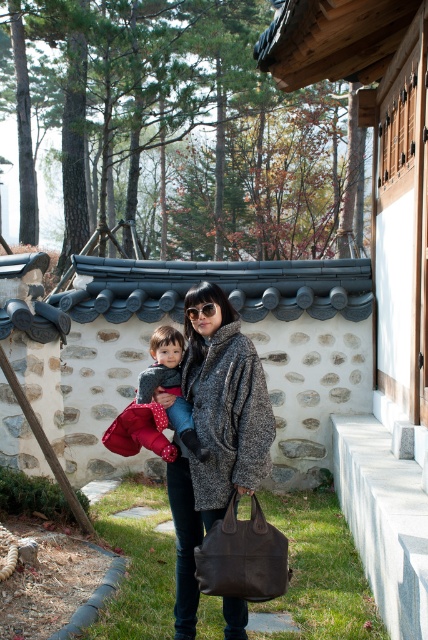
Who is positioned more to the left, brown leather bag at lower center or polka dot fabric baby at center?

polka dot fabric baby at center is more to the left.

Can you confirm if brown leather bag at lower center is positioned above polka dot fabric baby at center?

No, brown leather bag at lower center is not above polka dot fabric baby at center.

At what (x,y) coordinates should I click in order to perform the action: click on brown leather bag at lower center. Please return your answer as a coordinate pair (x, y). The height and width of the screenshot is (640, 428). Looking at the image, I should click on (243, 556).

At what (x,y) coordinates should I click in order to perform the action: click on brown leather bag at lower center. Please return your answer as a coordinate pair (x, y). Image resolution: width=428 pixels, height=640 pixels. Looking at the image, I should click on (243, 556).

Can you confirm if textured gray coat at center is thinner than polka dot fabric baby at center?

No, textured gray coat at center is not thinner than polka dot fabric baby at center.

This screenshot has width=428, height=640. In order to click on textured gray coat at center in this screenshot , I will do `click(214, 433)`.

Which is in front, point (205, 445) or point (162, 333)?

Point (205, 445)

What are the coordinates of `textured gray coat at center` in the screenshot? It's located at (214, 433).

From the picture: Does textured gray coat at center have a lesser height compared to brown leather bag at lower center?

Incorrect, textured gray coat at center's height does not fall short of brown leather bag at lower center's.

Is textured gray coat at center to the right of brown leather bag at lower center from the viewer's perspective?

Incorrect, textured gray coat at center is not on the right side of brown leather bag at lower center.

Where is `textured gray coat at center`? textured gray coat at center is located at coordinates (214, 433).

At what (x,y) coordinates should I click in order to perform the action: click on textured gray coat at center. Please return your answer as a coordinate pair (x, y). The height and width of the screenshot is (640, 428). Looking at the image, I should click on pos(214,433).